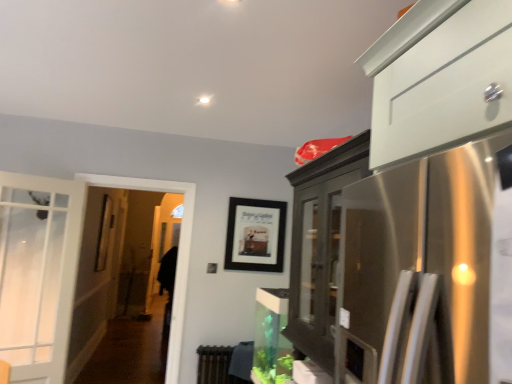
At what (x,y) coordinates should I click in order to perform the action: click on black matte picture frame at center. Please return your answer as a coordinate pair (x, y). This screenshot has width=512, height=384. Looking at the image, I should click on (255, 235).

Locate an element on the screen. This screenshot has height=384, width=512. clear glass screen door at left is located at coordinates (180, 248).

From their relative heights in the image, would you say brown textured radiator at lower center is taller or shorter than clear glass screen door at left?

brown textured radiator at lower center is shorter than clear glass screen door at left.

Considering the sizes of objects brown textured radiator at lower center and clear glass screen door at left in the image provided, who is thinner, brown textured radiator at lower center or clear glass screen door at left?

brown textured radiator at lower center.

Find the location of a particular element. The image size is (512, 384). radiator directly beneath the clear glass screen door at left (from a real-world perspective) is located at coordinates (216, 366).

From a real-world perspective, does clear glass screen door at left sit lower than black matte picture frame at center?

Yes, from a real-world perspective, clear glass screen door at left is under black matte picture frame at center.

Which is in front, point (186, 261) or point (253, 230)?

The point (186, 261) is more forward.

In the scene shown: From the image's perspective, is clear glass screen door at left positioned above or below black matte picture frame at center?

Based on their image positions, clear glass screen door at left is located beneath black matte picture frame at center.

Consider the image. Which of these two, clear glass screen door at left or brown textured radiator at lower center, is thinner?

Thinner between the two is brown textured radiator at lower center.

Which object is further away from the camera, clear glass screen door at left or brown textured radiator at lower center?

brown textured radiator at lower center is behind.

Which is correct: clear glass screen door at left is inside brown textured radiator at lower center, or outside of it?

clear glass screen door at left cannot be found inside brown textured radiator at lower center.

From a real-world perspective, between clear glass screen door at left and brown textured radiator at lower center, who is vertically lower?

In real-world perspective, brown textured radiator at lower center is lower.

Is brown textured radiator at lower center positioned with its back to black matte picture frame at center?

That's not correct — brown textured radiator at lower center is not looking away from black matte picture frame at center.

You are a GUI agent. You are given a task and a screenshot of the screen. Output one action in this format:
    pyautogui.click(x=<x>, y=<y>)
    Task: Click on the picture frame above the brown textured radiator at lower center (from a real-world perspective)
    The height and width of the screenshot is (384, 512).
    Given the screenshot: What is the action you would take?
    pyautogui.click(x=255, y=235)

Which of these two, brown textured radiator at lower center or black matte picture frame at center, is bigger?

Bigger between the two is brown textured radiator at lower center.

Does point (225, 371) lie behind point (268, 261)?

No, it is not.

Is black matte picture frame at center to the left or to the right of clear glass screen door at left in the image?

From the image, it's evident that black matte picture frame at center is to the right of clear glass screen door at left.

How many degrees apart are the facing directions of black matte picture frame at center and clear glass screen door at left?

The angle between the facing direction of black matte picture frame at center and the facing direction of clear glass screen door at left is 0.208 degrees.

Is black matte picture frame at center not close to clear glass screen door at left?

No.

Is black matte picture frame at center taller or shorter than clear glass screen door at left?

In the image, black matte picture frame at center appears to be shorter than clear glass screen door at left.

Are black matte picture frame at center and brown textured radiator at lower center far apart?

No.

Can you confirm if black matte picture frame at center is wider than brown textured radiator at lower center?

Incorrect, the width of black matte picture frame at center does not surpass that of brown textured radiator at lower center.

Is black matte picture frame at center turned away from brown textured radiator at lower center?

That's not correct — black matte picture frame at center is not looking away from brown textured radiator at lower center.

Looking at the image, does black matte picture frame at center seem bigger or smaller compared to brown textured radiator at lower center?

black matte picture frame at center is smaller than brown textured radiator at lower center.

Find the location of a particular element. This screenshot has width=512, height=384. radiator behind the clear glass screen door at left is located at coordinates (216, 366).

I want to click on screen door below the black matte picture frame at center (from a real-world perspective), so click(180, 248).

Considering their positions, is black matte picture frame at center positioned closer to clear glass screen door at left than brown textured radiator at lower center?

Based on the image, brown textured radiator at lower center appears to be nearer to clear glass screen door at left.

From the image, which object appears to be nearer to black matte picture frame at center, brown textured radiator at lower center or clear glass screen door at left?

clear glass screen door at left is positioned closer to the anchor black matte picture frame at center.

Based on their spatial positions, is black matte picture frame at center or clear glass screen door at left closer to brown textured radiator at lower center?

The object closer to brown textured radiator at lower center is clear glass screen door at left.

Considering their positions, is brown textured radiator at lower center positioned closer to clear glass screen door at left than black matte picture frame at center?

brown textured radiator at lower center.

When comparing their distances from black matte picture frame at center, does clear glass screen door at left or brown textured radiator at lower center seem closer?

clear glass screen door at left is positioned closer to the anchor black matte picture frame at center.

Based on the photo, considering their positions, is clear glass screen door at left positioned closer to brown textured radiator at lower center than black matte picture frame at center?

The object closer to brown textured radiator at lower center is clear glass screen door at left.

I want to click on radiator located between clear glass screen door at left and black matte picture frame at center in the left-right direction, so 216,366.